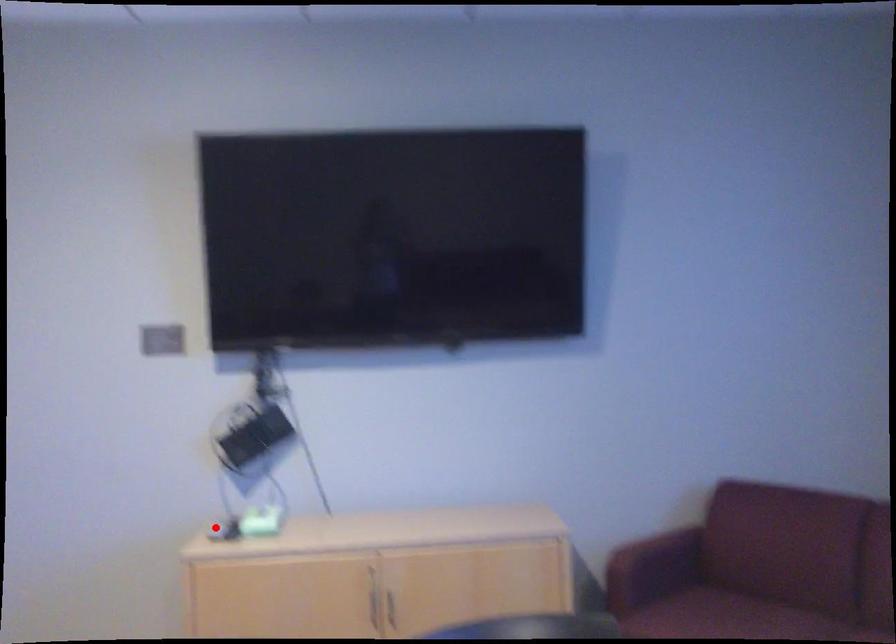
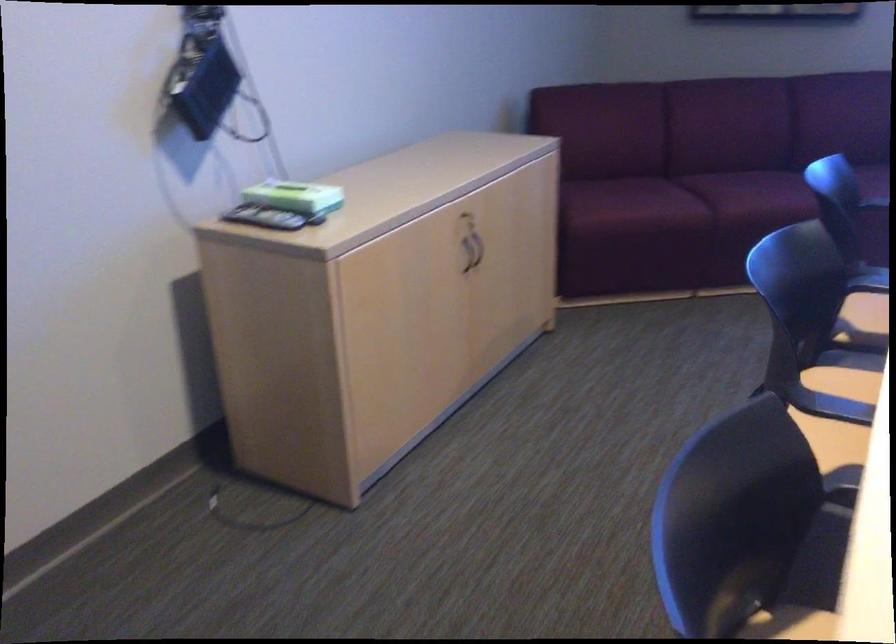
Question: A red point is marked in image1. In image2, is the corresponding 3D point closer to the camera or farther? Reply with the corresponding letter.

Choices:
 (A) The corresponding 3D point is closer.
 (B) The corresponding 3D point is farther.

Answer: (A)